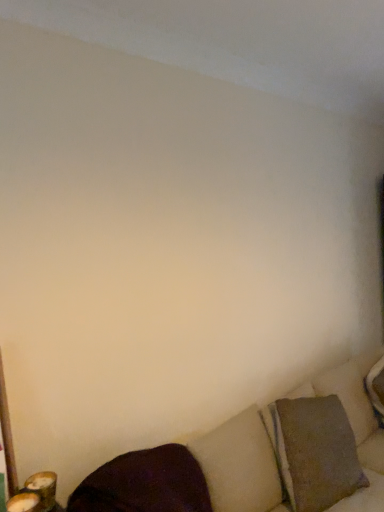
Question: Considering the relative sizes of textured beige couch at lower right and dark matte pillow at lower left, arranged as the second pillow when viewed from the right, in the image provided, is textured beige couch at lower right shorter than dark matte pillow at lower left, arranged as the second pillow when viewed from the right,?

Choices:
 (A) no
 (B) yes

Answer: (A)

Question: Is dark matte pillow at lower left, marked as the 1th pillow in a left-to-right arrangement, completely or partially inside textured beige couch at lower right?

Choices:
 (A) yes
 (B) no

Answer: (A)

Question: Is textured beige couch at lower right positioned with its back to dark matte pillow at lower left, which ranks as the second pillow in back-to-front order?

Choices:
 (A) yes
 (B) no

Answer: (A)

Question: Is textured beige couch at lower right behind dark matte pillow at lower left, which is the 1th pillow in front-to-back order?

Choices:
 (A) no
 (B) yes

Answer: (A)

Question: Does textured beige couch at lower right have a lesser width compared to dark matte pillow at lower left, which ranks as the second pillow in back-to-front order?

Choices:
 (A) yes
 (B) no

Answer: (B)

Question: From a real-world perspective, is textured beige couch at lower right on top of dark matte pillow at lower left, which ranks as the second pillow in back-to-front order?

Choices:
 (A) yes
 (B) no

Answer: (B)

Question: From a real-world perspective, does dark matte pillow at lower left, which is the 1th pillow in front-to-back order, stand above textured beige couch at lower right?

Choices:
 (A) yes
 (B) no

Answer: (A)

Question: Is the position of dark matte pillow at lower left, which ranks as the second pillow in back-to-front order, less distant than that of textured beige couch at lower right?

Choices:
 (A) no
 (B) yes

Answer: (A)

Question: From the image's perspective, would you say dark matte pillow at lower left, arranged as the second pillow when viewed from the right, is shown under textured beige couch at lower right?

Choices:
 (A) yes
 (B) no

Answer: (B)

Question: Is dark matte pillow at lower left, marked as the 1th pillow in a left-to-right arrangement, turned away from textured beige couch at lower right?

Choices:
 (A) no
 (B) yes

Answer: (B)

Question: Is dark matte pillow at lower left, arranged as the second pillow when viewed from the right, thinner than textured beige couch at lower right?

Choices:
 (A) yes
 (B) no

Answer: (A)

Question: Is dark matte pillow at lower left, which ranks as the second pillow in back-to-front order, to the left of textured beige couch at lower right from the viewer's perspective?

Choices:
 (A) yes
 (B) no

Answer: (A)

Question: Considering the relative positions of textured brown pillow at lower right, the second pillow in the front-to-back sequence, and textured beige couch at lower right in the image provided, is textured brown pillow at lower right, the second pillow in the front-to-back sequence, behind textured beige couch at lower right?

Choices:
 (A) yes
 (B) no

Answer: (A)